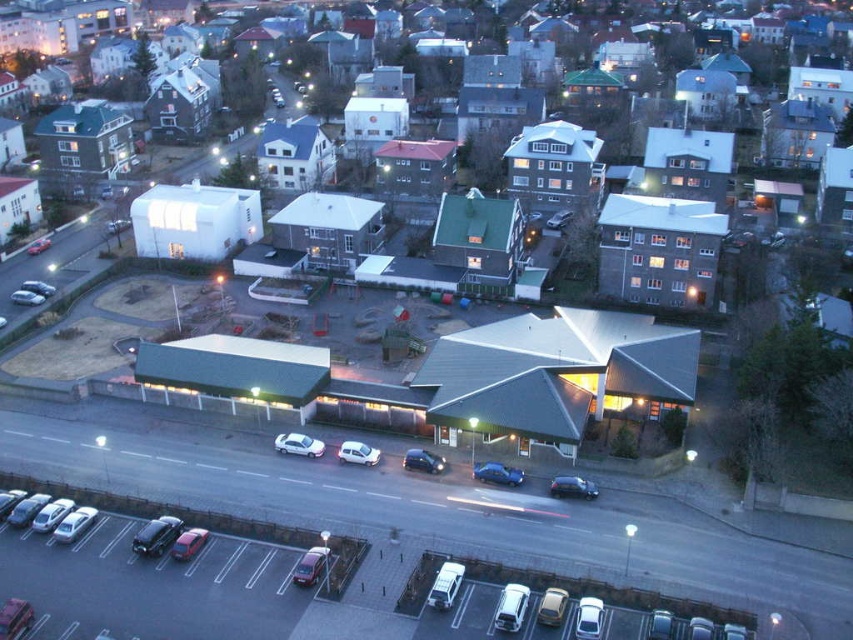
You are a delivery person trying to park your delivery van, which is 2 meters tall, in the parking lot. There are two cars parked in the center of the lot. One is a white matte car at center and the other is a shiny silver car at center. Which car should you avoid parking next to if you need to leave enough vertical space for your van?

The white matte car at center is much taller than the shiny silver car at center. Therefore, you should avoid parking next to the white matte car at center to ensure there is enough vertical space for your delivery van.

You are a delivery driver approaching the residential area and need to park your vehicle. You see the white matte car at center and the shiny silver car at center. Which car is closer to you, and can you park between them without moving either?

The white matte car at center is closer to you than the shiny silver car at center. However, since the white matte car is in front, parking between them would require space between the two, but the description does not provide information about the distance between them. You may need to check the actual gap.

You are a delivery driver approaching the residential area and need to park your car. You see metallic silver cars at lower left and a shiny silver car at center. Which parking spot is closer to you where you can park?

The metallic silver cars at lower left is closer to the viewer than the shiny silver car at center, so the parking spot near the metallic silver cars at lower left is closer and available for parking.